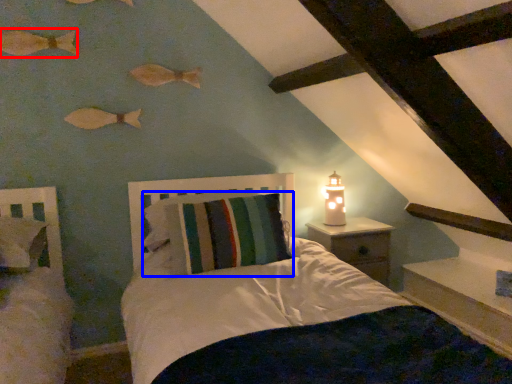
Question: Which point is further to the camera, fish (highlighted by a red box) or pillow (highlighted by a blue box)?

Choices:
 (A) fish
 (B) pillow

Answer: (A)